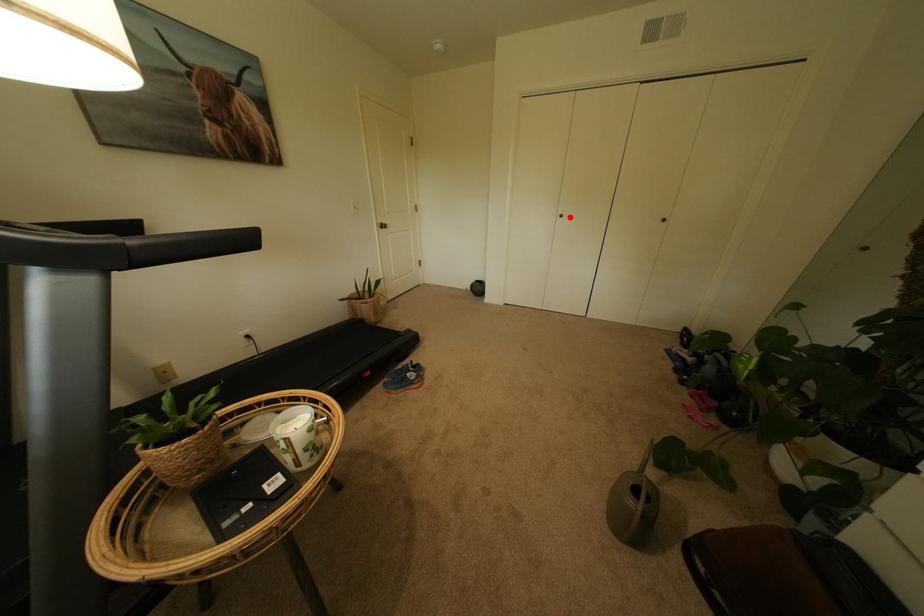
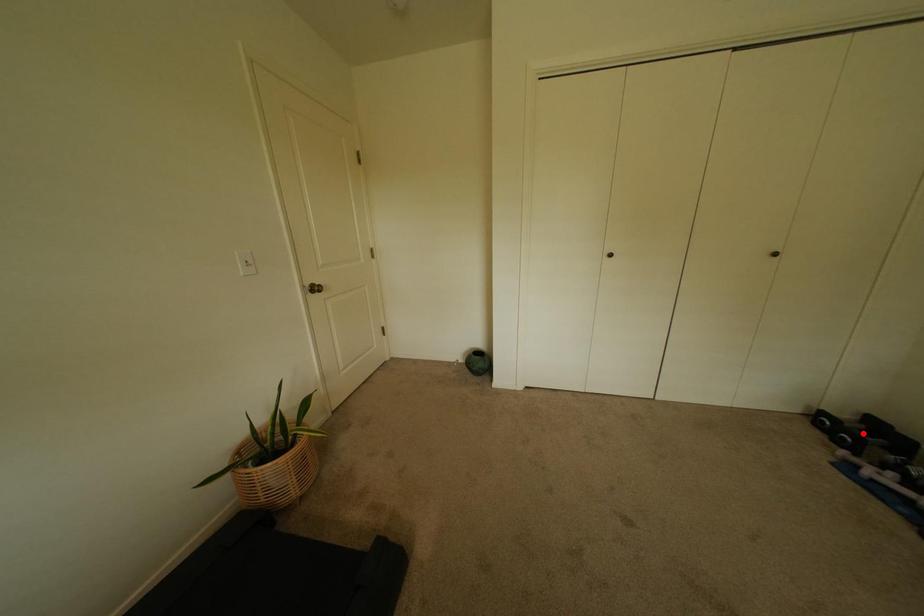
I am providing you with two images of the same scene from different viewpoints. A red point is marked on the first image and another point is marked on the second image. Does the point marked in image1 correspond to the same location as the one in image2?

No